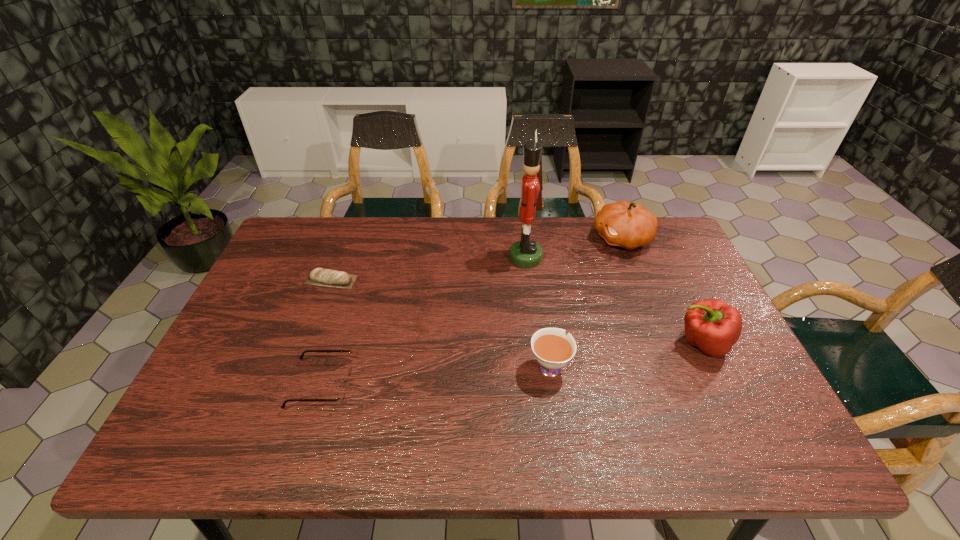
Where is `free space between the tallest object and the fifth shortest object`? The width and height of the screenshot is (960, 540). free space between the tallest object and the fifth shortest object is located at coordinates (574, 248).

At what (x,y) coordinates should I click in order to perform the action: click on free spot between the pumpkin and the tallest object. Please return your answer as a coordinate pair (x, y). Image resolution: width=960 pixels, height=540 pixels. Looking at the image, I should click on (574, 248).

At what (x,y) coordinates should I click in order to perform the action: click on free area in between the tallest object and the fourth nearest object. Please return your answer as a coordinate pair (x, y). Image resolution: width=960 pixels, height=540 pixels. Looking at the image, I should click on coord(428,269).

Find the location of a particular element. free space between the fifth tallest object and the nutcracker is located at coordinates (424, 321).

Find the location of a particular element. The image size is (960, 540). free space that is in between the fifth tallest object and the third farthest object is located at coordinates coord(326,332).

Locate an element on the screen. Image resolution: width=960 pixels, height=540 pixels. vacant space in between the third farthest object and the nutcracker is located at coordinates (428, 269).

You are a GUI agent. You are given a task and a screenshot of the screen. Output one action in this format:
    pyautogui.click(x=<x>, y=<y>)
    Task: Click on the empty location between the pumpkin and the tallest object
    
    Given the screenshot: What is the action you would take?
    click(x=574, y=248)

This screenshot has height=540, width=960. Identify the location of empty location between the bell pepper and the spectacles. (513, 364).

At what (x,y) coordinates should I click in order to perform the action: click on unoccupied area between the teacup and the second tallest object. Please return your answer as a coordinate pair (x, y). The height and width of the screenshot is (540, 960). Looking at the image, I should click on (586, 302).

Where is `the fifth closest object to the second tallest object`? The width and height of the screenshot is (960, 540). the fifth closest object to the second tallest object is located at coordinates (341, 398).